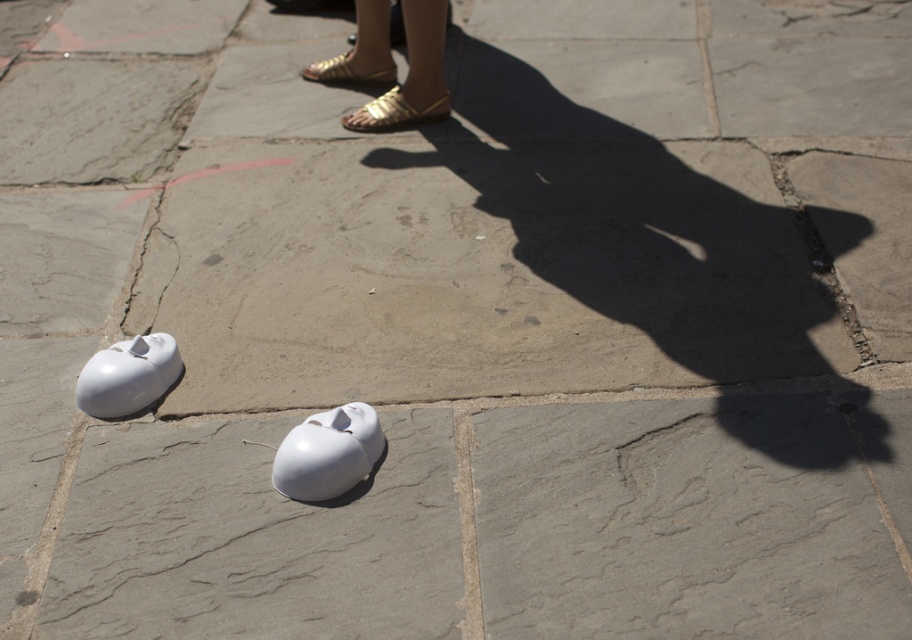
You are a delivery robot with a width of 0.5 meters. You need to move from the gold metallic sandals at upper center to the white matte mouse at lower left. Is there enough space between them for you to pass through?

The gold metallic sandals at upper center might be wider than the white matte mouse at lower left, so there may not be enough space for the robot to pass through safely. It is recommended to choose a different path.

In the scene shown: You are standing on the paved surface and see the gold metallic sandals at upper center. Where exactly are they located in terms of coordinates?

The gold metallic sandals at upper center are located at coordinates point (412, 74).